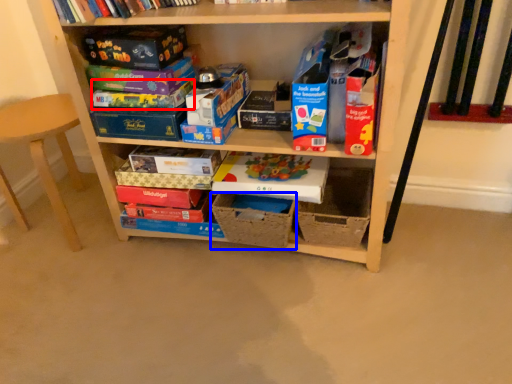
Question: Which object is further to the camera taking this photo, paperback book (highlighted by a red box) or storage box (highlighted by a blue box)?

Choices:
 (A) paperback book
 (B) storage box

Answer: (B)